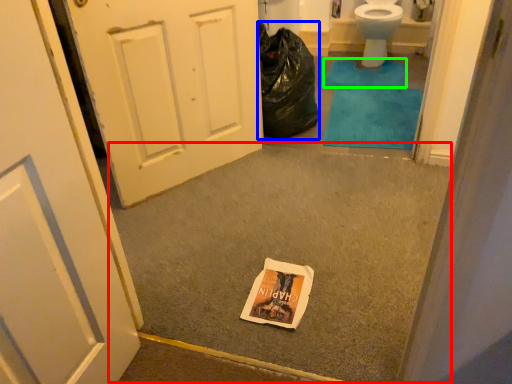
Question: Which object is positioned farthest from concrete (highlighted by a red box)? Select from garbage (highlighted by a blue box) and bath mat (highlighted by a green box).

Choices:
 (A) garbage
 (B) bath mat

Answer: (B)